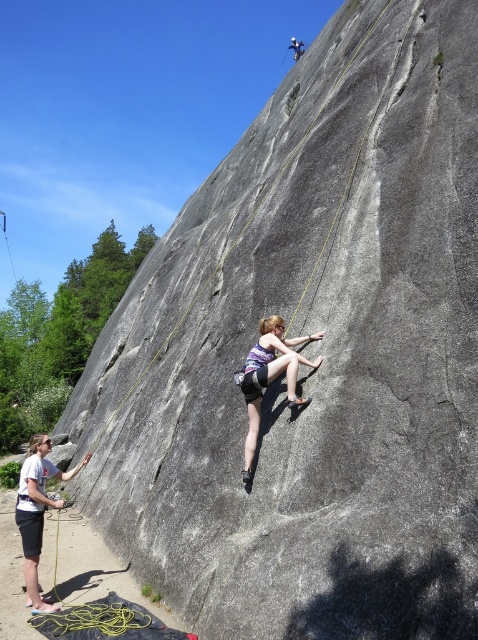
You are a safety observer at the climbing site. You see the matte purple tank top at center and the matte gray rock climber at center. Which object is positioned in front of the other?

The matte purple tank top at center is closer to the viewer than the matte gray rock climber at center, so it is positioned in front of the matte gray rock climber at center.

You are a hiker planning to climb the rock. You see the white cotton shirt at lower left and the matte gray rock climber at center. Which object is closer to the left edge of the rock?

The white cotton shirt at lower left is positioned on the left side of the matte gray rock climber at center, so it is closer to the left edge of the rock.